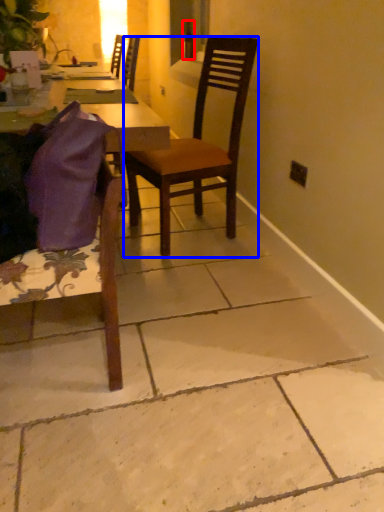
Question: Which of the following is the farthest to the observer, bottle (highlighted by a red box) or chair (highlighted by a blue box)?

Choices:
 (A) bottle
 (B) chair

Answer: (A)